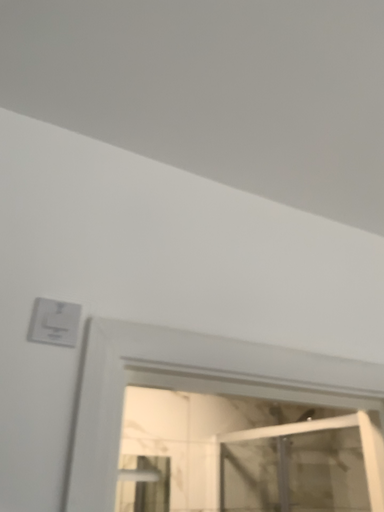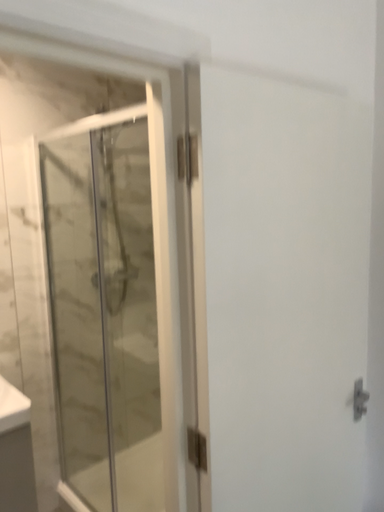
Question: Which way did the camera rotate in the video?

Choices:
 (A) rotated right
 (B) rotated left

Answer: (A)